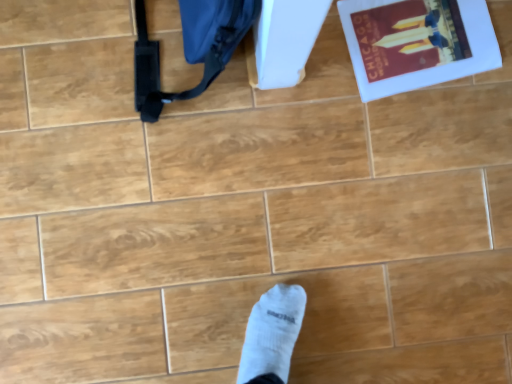
You are a GUI agent. You are given a task and a screenshot of the screen. Output one action in this format:
    pyautogui.click(x=<x>, y=<y>)
    Task: Click on the blank space above matte paper book at upper right (from a real-world perspective)
    The image size is (512, 384).
    Given the screenshot: What is the action you would take?
    pyautogui.click(x=421, y=43)